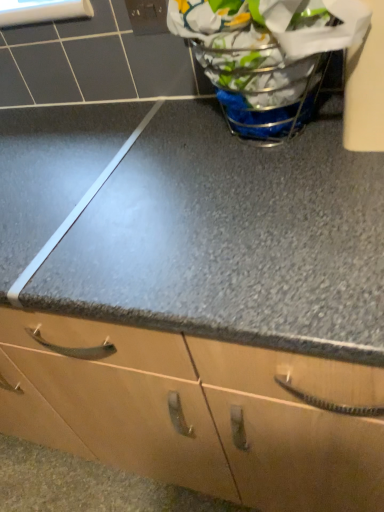
The width and height of the screenshot is (384, 512). What do you see at coordinates (265, 40) in the screenshot?
I see `metallic wire basket at upper right` at bounding box center [265, 40].

Locate an element on the screen. metallic wire basket at upper right is located at coordinates (265, 40).

Where is `metallic wire basket at upper right`? The image size is (384, 512). metallic wire basket at upper right is located at coordinates (265, 40).